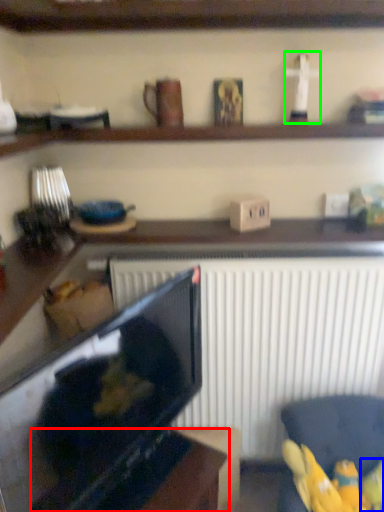
Question: Estimate the real-world distances between objects in this image. Which object is farther from table (highlighted by a red box), toy (highlighted by a blue box) or toy (highlighted by a green box)?

Choices:
 (A) toy
 (B) toy

Answer: (B)